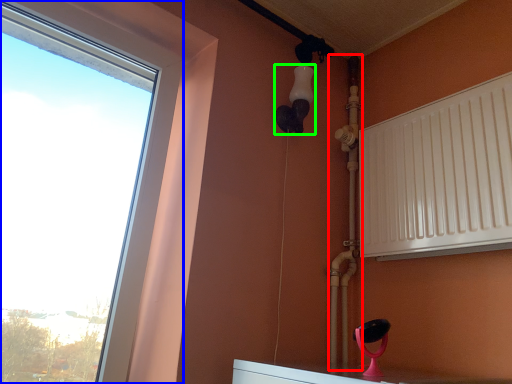
Question: Which is farther away from pipe (highlighted by a red box)? window (highlighted by a blue box) or light fixture (highlighted by a green box)?

Choices:
 (A) window
 (B) light fixture

Answer: (A)